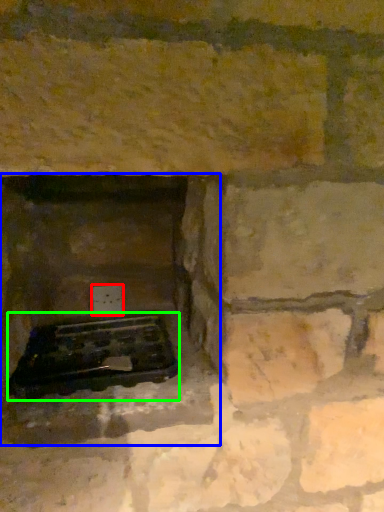
Question: Which is nearer to the electric outlet (highlighted by a red box)? fireplace (highlighted by a blue box) or grill (highlighted by a green box).

Choices:
 (A) fireplace
 (B) grill

Answer: (A)